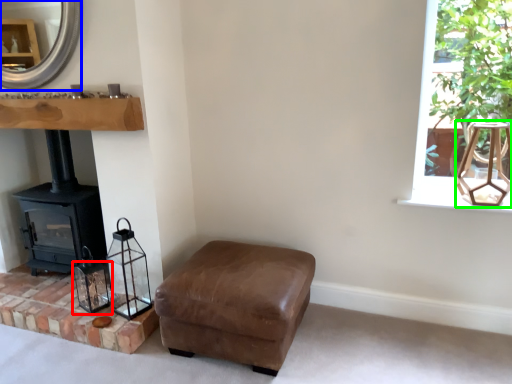
Question: Based on their relative distances, which object is farther from candle holder (highlighted by a red box)? Choose from fireplace (highlighted by a blue box) and lamp (highlighted by a green box).

Choices:
 (A) fireplace
 (B) lamp

Answer: (B)